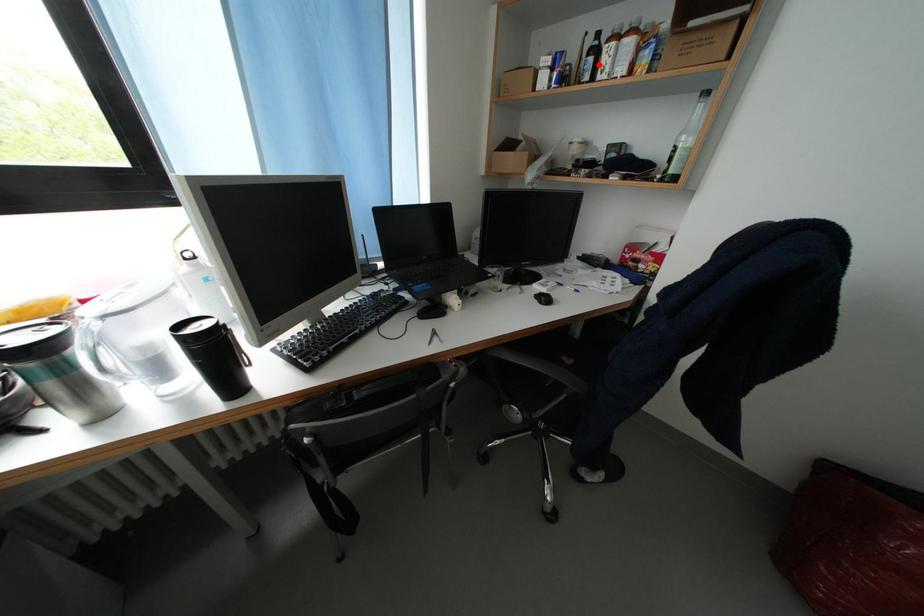
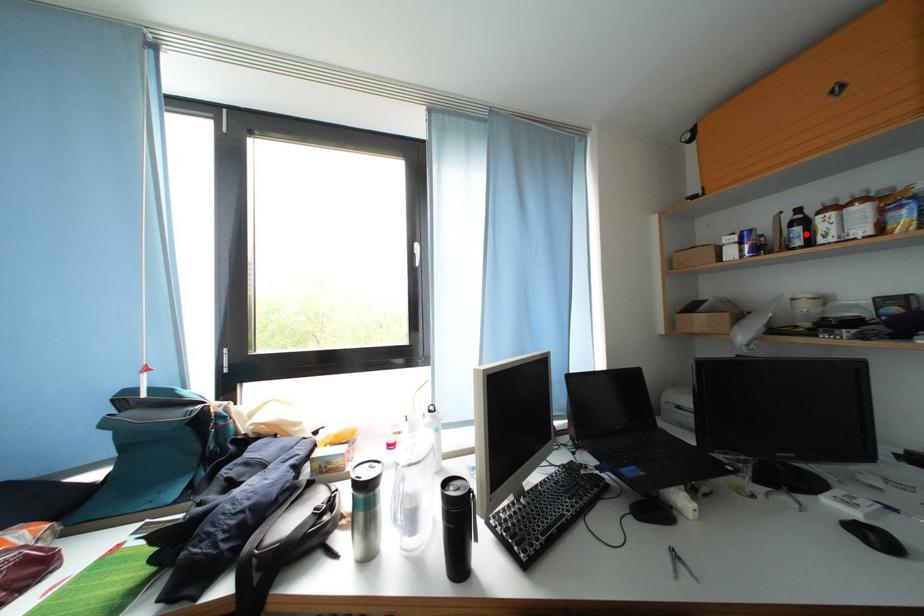
I am providing you with two images of the same scene from different viewpoints. A red point is marked on the first image and another point is marked on the second image. Is the marked point in image1 the same physical position as the marked point in image2?

Yes